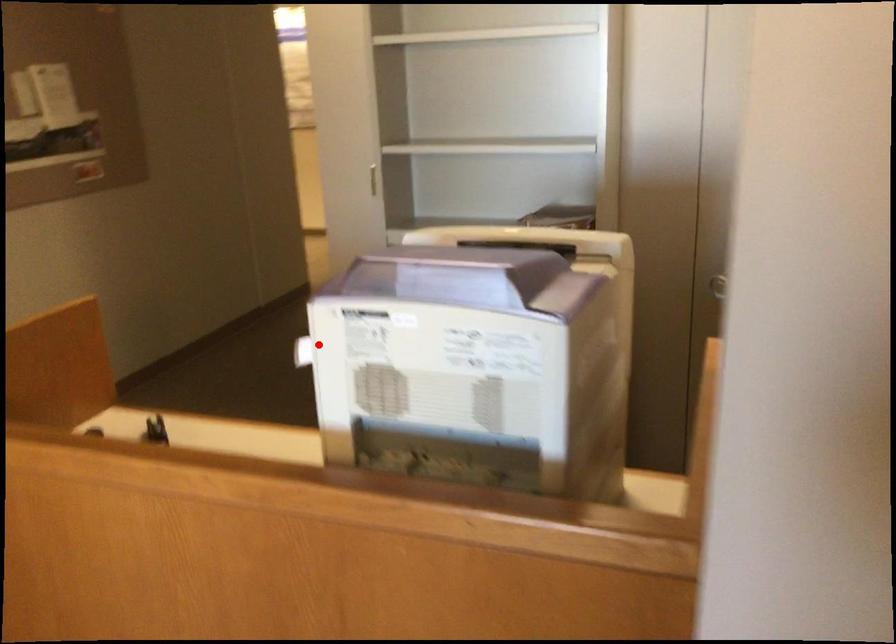
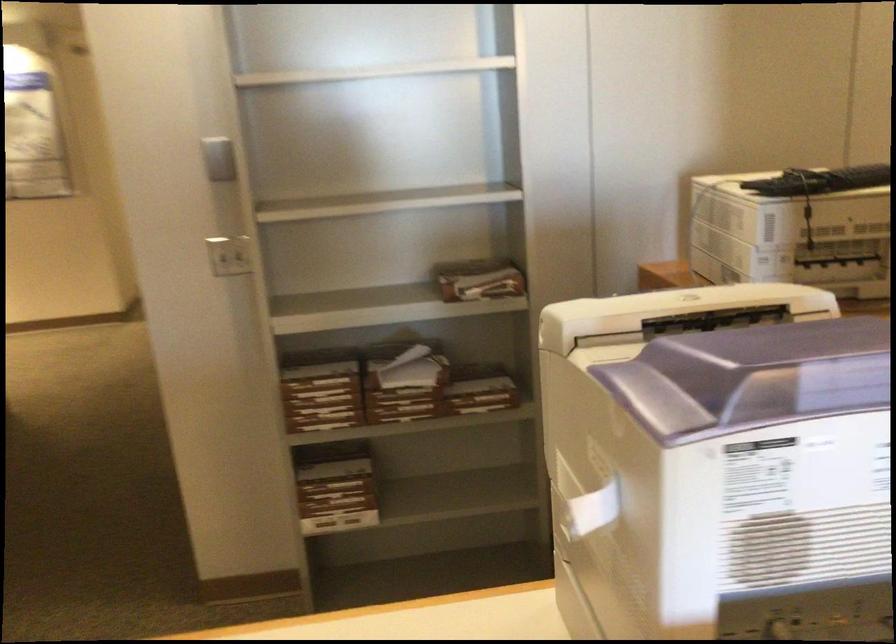
Question: A red point is marked in image1. In image2, is the corresponding 3D point closer to the camera or farther? Reply with the corresponding letter.

Choices:
 (A) The corresponding 3D point is closer.
 (B) The corresponding 3D point is farther.

Answer: (A)